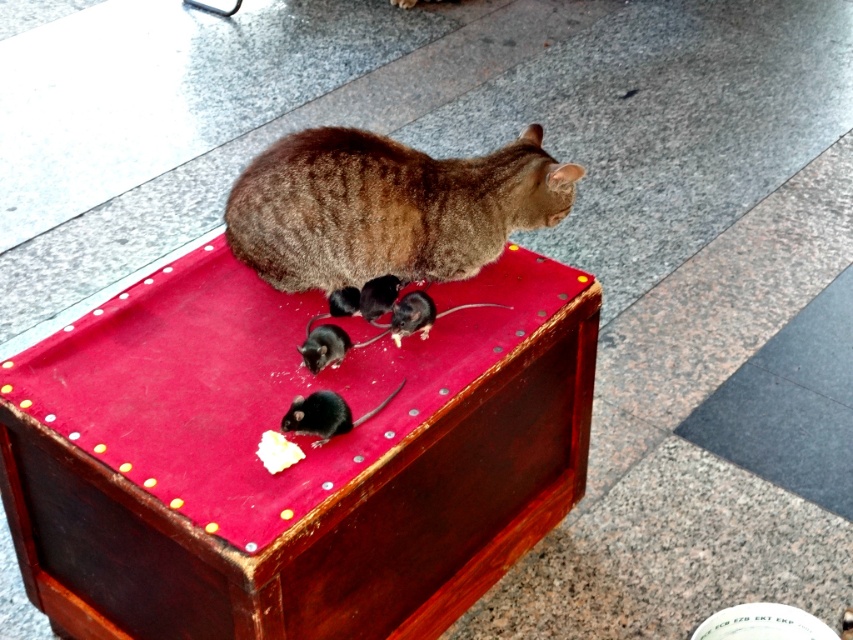
The width and height of the screenshot is (853, 640). I want to click on wooden stool at center, so click(294, 465).

Does wooden stool at center have a greater height compared to brown fur cat at center?

Correct, wooden stool at center is much taller as brown fur cat at center.

Is point (164, 454) positioned after point (300, 148)?

No, (164, 454) is in front of (300, 148).

Identify the location of wooden stool at center. (294, 465).

Is wooden stool at center bigger than shiny black mouse at center?

Yes.

How far apart are wooden stool at center and shiny black mouse at center?

wooden stool at center and shiny black mouse at center are 27.78 centimeters apart.

Which is behind, point (18, 387) or point (322, 429)?

Point (18, 387)

The height and width of the screenshot is (640, 853). I want to click on wooden stool at center, so click(294, 465).

Is shiny black mouse at center bigger than black matte mouse at center?

Yes.

In the scene shown: Does shiny black mouse at center have a greater width compared to black matte mouse at center?

Indeed, shiny black mouse at center has a greater width compared to black matte mouse at center.

Who is more distant from viewer, (296, 433) or (311, 346)?

Positioned behind is point (311, 346).

Locate an element on the screen. The image size is (853, 640). shiny black mouse at center is located at coordinates (325, 413).